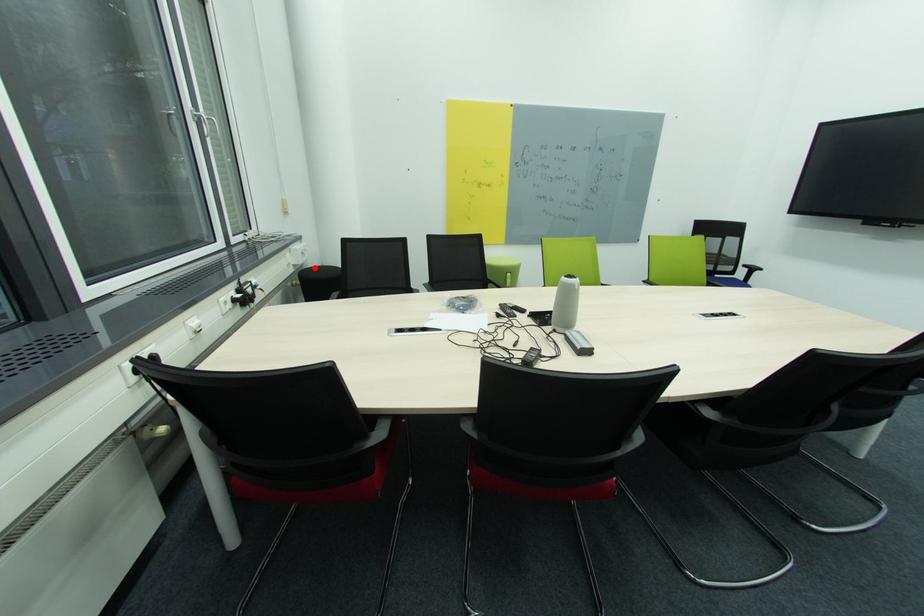
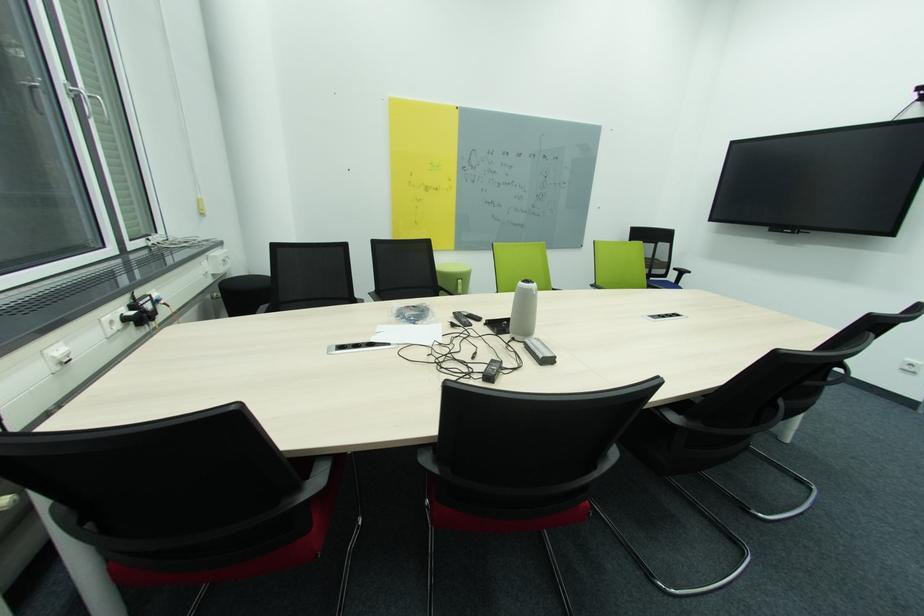
Question: I am providing you with two images of the same scene from different viewpoints. A red point is marked on the first image. Can you still see the location of the red point in image 2?

Choices:
 (A) Yes
 (B) No

Answer: (A)